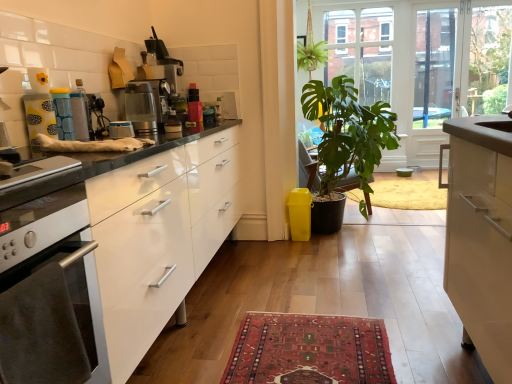
You are a GUI agent. You are given a task and a screenshot of the screen. Output one action in this format:
    pyautogui.click(x=<x>, y=<y>)
    Task: Click on the green matte plant at center
    Image resolution: width=512 pixels, height=384 pixels.
    Given the screenshot: What is the action you would take?
    pyautogui.click(x=347, y=132)

At what (x,y) coordinates should I click in order to perform the action: click on transparent glass door at upper center. Please return your answer as a coordinate pair (x, y). The height and width of the screenshot is (384, 512). Looking at the image, I should click on (361, 50).

Find the location of a particular element. yellow plastic trash bin/can at lower right is located at coordinates (300, 213).

Where is `matte yellow container at upper left, arranged as the 1th appliance when viewed from the left`? matte yellow container at upper left, arranged as the 1th appliance when viewed from the left is located at coordinates (39, 116).

From a real-world perspective, who is located higher, satin silver coffee machine at upper center or clear glass screen door at upper right?

From a 3D spatial view, satin silver coffee machine at upper center is above.

Is satin silver coffee machine at upper center facing away from clear glass screen door at upper right?

No, satin silver coffee machine at upper center's orientation is not away from clear glass screen door at upper right.

Considering the points (174, 84) and (423, 53), which point is behind, point (174, 84) or point (423, 53)?

Point (423, 53)

Find the location of a particular element. coffee machine on the left of clear glass screen door at upper right is located at coordinates (161, 76).

Is transparent glass door at upper center located outside silver metallic oven at left?

transparent glass door at upper center is positioned outside silver metallic oven at left.

Can you confirm if transparent glass door at upper center is bigger than silver metallic oven at left?

Yes, transparent glass door at upper center is bigger than silver metallic oven at left.

From a real-world perspective, is transparent glass door at upper center on top of silver metallic oven at left?

Yes, from a real-world perspective, transparent glass door at upper center is on top of silver metallic oven at left.

Looking at their sizes, would you say transparent glass door at upper center is wider or thinner than silver metallic oven at left?

Clearly, transparent glass door at upper center has less width compared to silver metallic oven at left.

Is yellow plastic trash bin/can at lower right located within brushed metal toaster at center, which appears as the 3th appliance when viewed from the left?

Definitely not — yellow plastic trash bin/can at lower right is not inside brushed metal toaster at center, which appears as the 3th appliance when viewed from the left.

Consider the image. Between brushed metal toaster at center, which appears as the 3th appliance when viewed from the left, and yellow plastic trash bin/can at lower right, which one is positioned in front?

brushed metal toaster at center, which appears as the 3th appliance when viewed from the left.

Can you confirm if brushed metal toaster at center, which is counted as the 1th appliance, starting from the right, is smaller than yellow plastic trash bin/can at lower right?

Yes.

Does satin silver coffee machine at upper center contain silver metallic oven at left?

No.

Considering the positions of points (144, 80) and (17, 364), is point (144, 80) farther from camera compared to point (17, 364)?

That is True.

Identify the location of kitchen appliance below the satin silver coffee machine at upper center (from a real-world perspective). Image resolution: width=512 pixels, height=384 pixels. coord(51,301).

Does satin silver coffee machine at upper center lie behind silver metallic oven at left?

Yes, satin silver coffee machine at upper center is further from the viewer.

From the image's perspective, between clear glass screen door at upper right and metallic silver coffee maker at center, which one is located above?

From the image's view, clear glass screen door at upper right is above.

Considering the sizes of objects clear glass screen door at upper right and metallic silver coffee maker at center in the image provided, who is wider, clear glass screen door at upper right or metallic silver coffee maker at center?

metallic silver coffee maker at center.

Which object is further away from the camera taking this photo, clear glass screen door at upper right or metallic silver coffee maker at center?

clear glass screen door at upper right.

Considering the sizes of clear glass screen door at upper right and metallic silver coffee maker at center in the image, is clear glass screen door at upper right taller or shorter than metallic silver coffee maker at center?

clear glass screen door at upper right is taller than metallic silver coffee maker at center.

Which is in front, matte blue canister at center, acting as the 2th appliance starting from the right, or silver metallic oven at left?

silver metallic oven at left is in front.

Which is in front, point (59, 101) or point (37, 319)?

The point (37, 319) is more forward.

Looking at this image, is matte blue canister at center, acting as the 2th appliance starting from the right, oriented away from silver metallic oven at left?

No, matte blue canister at center, acting as the 2th appliance starting from the right, is not facing away from silver metallic oven at left.

Identify the location of kitchen appliance on the right of matte blue canister at center, which is counted as the second appliance, starting from the left. The height and width of the screenshot is (384, 512). (51, 301).

Consider the image. From a real-world perspective, does silver metallic oven at left stand above clear glass screen door at upper right?

Actually, silver metallic oven at left is physically below clear glass screen door at upper right in the real world.

Is silver metallic oven at left not near clear glass screen door at upper right?

Yes, silver metallic oven at left and clear glass screen door at upper right are quite far apart.

Is the depth of silver metallic oven at left greater than that of clear glass screen door at upper right?

No, the depth of silver metallic oven at left is less than that of clear glass screen door at upper right.

Is clear glass screen door at upper right at the back of silver metallic oven at left?

No, silver metallic oven at left's orientation is not away from clear glass screen door at upper right.

Image resolution: width=512 pixels, height=384 pixels. What are the coordinates of `coffee machine below the clear glass screen door at upper right (from the image's perspective)` in the screenshot? It's located at (161, 76).

Locate an element on the screen. Image resolution: width=512 pixels, height=384 pixels. kitchen appliance that is under the transparent glass door at upper center (from a real-world perspective) is located at coordinates (51, 301).

When comparing their distances from green matte plant at center, does clear glass screen door at upper right or matte yellow container at upper left, arranged as the 1th appliance when viewed from the left, seem closer?

Based on the image, clear glass screen door at upper right appears to be nearer to green matte plant at center.

Looking at the image, which one is located closer to matte yellow container at upper left, arranged as the 1th appliance when viewed from the left, yellow plastic trash bin/can at lower right or metallic silver coffee maker at center?

metallic silver coffee maker at center is positioned closer to the anchor matte yellow container at upper left, arranged as the 1th appliance when viewed from the left.

Looking at this image, considering their positions, is brushed metal toaster at center, which appears as the 3th appliance when viewed from the left, positioned further to silver metallic oven at left than clear glass screen door at upper right?

clear glass screen door at upper right is positioned further to the anchor silver metallic oven at left.

Looking at the image, which one is located further to satin silver coffee machine at upper center, silver metallic oven at left or transparent glass door at upper center?

transparent glass door at upper center is further to satin silver coffee machine at upper center.

From the image, which object appears to be farther from clear glass screen door at upper right, matte yellow container at upper left, arranged as the third appliance when viewed from the right, or matte blue canister at center, acting as the 2th appliance starting from the right?

matte yellow container at upper left, arranged as the third appliance when viewed from the right, is positioned further to the anchor clear glass screen door at upper right.

Based on their spatial positions, is silver metallic oven at left or satin silver coffee machine at upper center further from green matte plant at center?

Based on the image, silver metallic oven at left appears to be further to green matte plant at center.

Based on the photo, when comparing their distances from green matte plant at center, does transparent glass door at upper center or satin silver coffee machine at upper center seem further?

transparent glass door at upper center.

In the scene shown: From the image, which object appears to be farther from clear glass screen door at upper right, yellow plastic trash bin/can at lower right or transparent glass door at upper center?

Among the two, yellow plastic trash bin/can at lower right is located further to clear glass screen door at upper right.

This screenshot has height=384, width=512. Find the location of `trash bin/can positioned between green matte plant at center and transparent glass door at upper center from near to far`. trash bin/can positioned between green matte plant at center and transparent glass door at upper center from near to far is located at coordinates (300, 213).

This screenshot has height=384, width=512. I want to click on houseplant between silver metallic oven at left and transparent glass door at upper center along the z-axis, so click(x=347, y=132).

Locate an element on the screen. appliance between silver metallic oven at left and brushed metal toaster at center, which is counted as the 1th appliance, starting from the right, in the front-back direction is located at coordinates (39, 116).

Where is `trash bin/can between brushed metal toaster at center, which appears as the 3th appliance when viewed from the left, and clear glass screen door at upper right, along the z-axis`? This screenshot has height=384, width=512. trash bin/can between brushed metal toaster at center, which appears as the 3th appliance when viewed from the left, and clear glass screen door at upper right, along the z-axis is located at coordinates (300, 213).